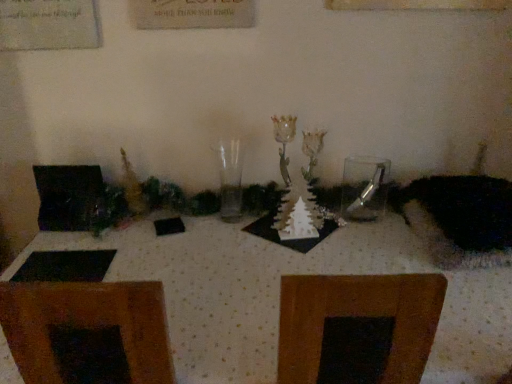
Where is `blank space to the left of fuzzy black cat at right`? The width and height of the screenshot is (512, 384). blank space to the left of fuzzy black cat at right is located at coordinates (375, 247).